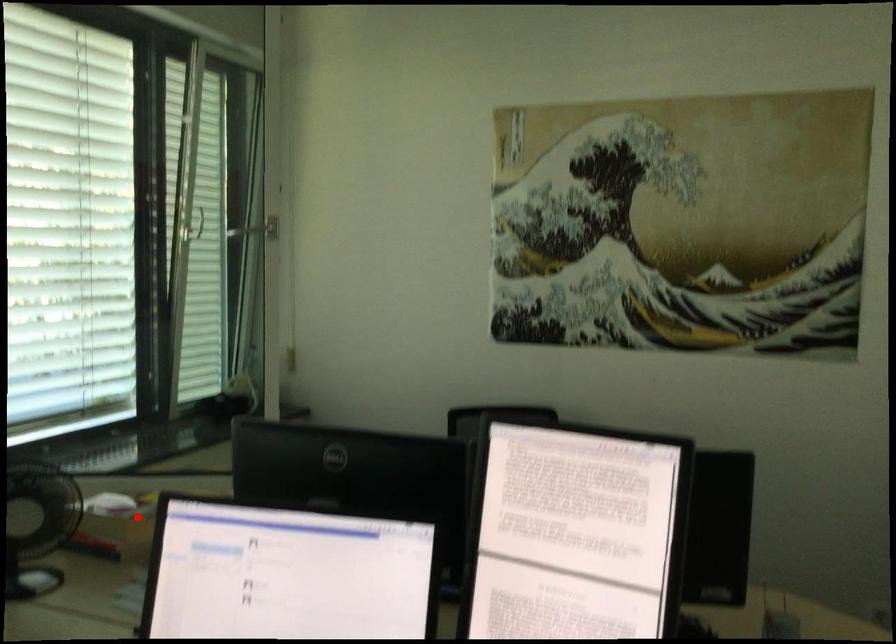
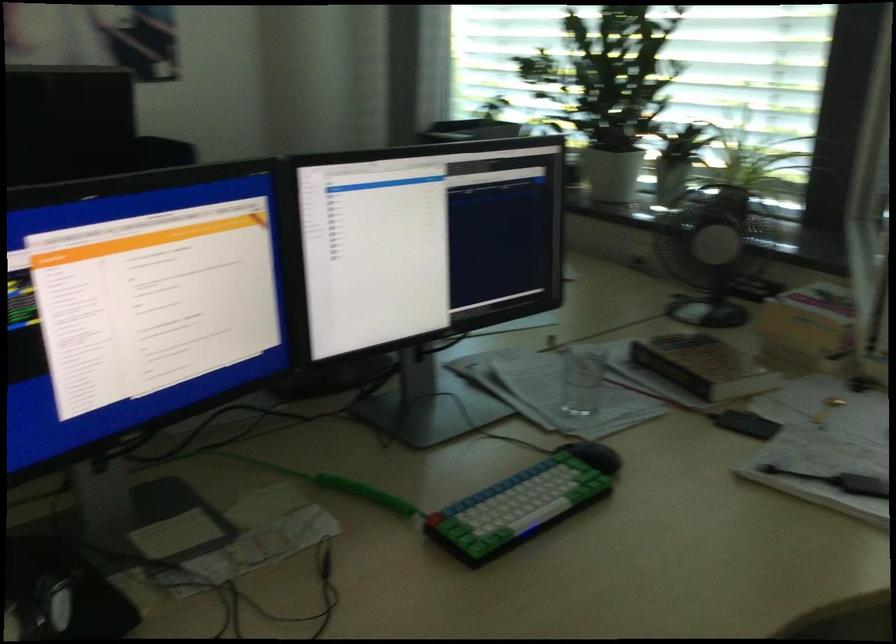
The point at the highlighted location is marked in the first image. Where is the corresponding point in the second image?

(810, 326)